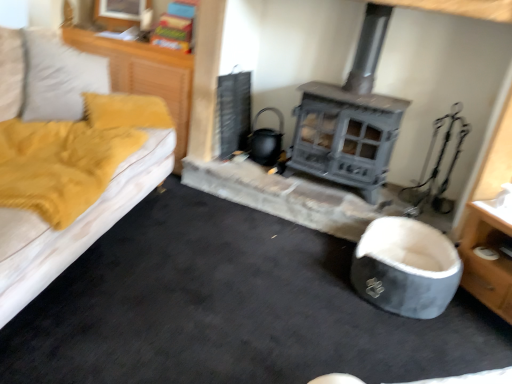
Question: From a real-world perspective, is wooden dresser at lower right, positioned as the first dresser in right-to-left order, physically located above or below gray fabric bean bag at lower right?

Choices:
 (A) above
 (B) below

Answer: (A)

Question: From the image's perspective, is wooden dresser at lower right, positioned as the first dresser in right-to-left order, located above or below gray fabric bean bag at lower right?

Choices:
 (A) below
 (B) above

Answer: (B)

Question: Which object is the farthest from the wooden dresser at lower right, which is counted as the 2th dresser, starting from the top?

Choices:
 (A) yellow fabric at left, the 1th dresser positioned from the top
 (B) gray fabric bean bag at lower right

Answer: (A)

Question: Which object is positioned closest to the wooden dresser at lower right, the second dresser in the left-to-right sequence?

Choices:
 (A) yellow fabric at left, which appears as the second dresser when ordered from the bottom
 (B) gray fabric bean bag at lower right

Answer: (B)